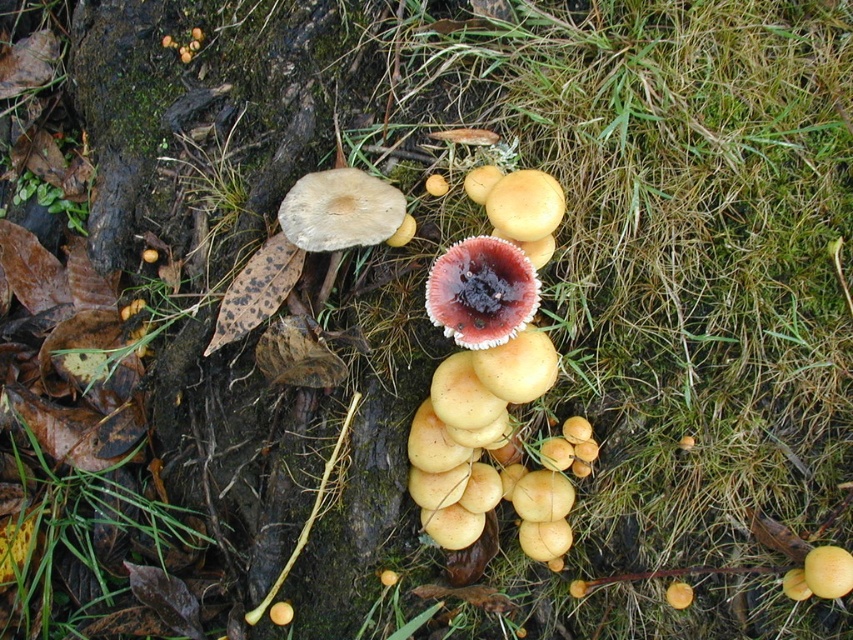
Does dark red velvety mushroom at center have a smaller size compared to light brown matte mushroom at upper center?

No, dark red velvety mushroom at center is not smaller than light brown matte mushroom at upper center.

Which is more to the left, dark red velvety mushroom at center or light brown matte mushroom at upper center?

Positioned to the left is light brown matte mushroom at upper center.

This screenshot has height=640, width=853. What do you see at coordinates (480, 291) in the screenshot?
I see `dark red velvety mushroom at center` at bounding box center [480, 291].

The image size is (853, 640). In order to click on dark red velvety mushroom at center in this screenshot , I will do `click(480, 291)`.

Measure the distance between point (469, 520) and camera.

Point (469, 520) and camera are 1.60 meters apart.

Can you confirm if yellowish-brown mushroom at center is thinner than dark red velvety mushroom at center?

Incorrect, yellowish-brown mushroom at center's width is not less than dark red velvety mushroom at center's.

The height and width of the screenshot is (640, 853). Identify the location of yellowish-brown mushroom at center. (482, 352).

Does yellowish-brown mushroom at center have a smaller size compared to light brown matte mushroom at upper center?

Incorrect, yellowish-brown mushroom at center is not smaller in size than light brown matte mushroom at upper center.

Is yellowish-brown mushroom at center closer to the viewer compared to light brown matte mushroom at upper center?

Yes, yellowish-brown mushroom at center is closer to the viewer.

Where is `yellowish-brown mushroom at center`? The width and height of the screenshot is (853, 640). yellowish-brown mushroom at center is located at coordinates (482, 352).